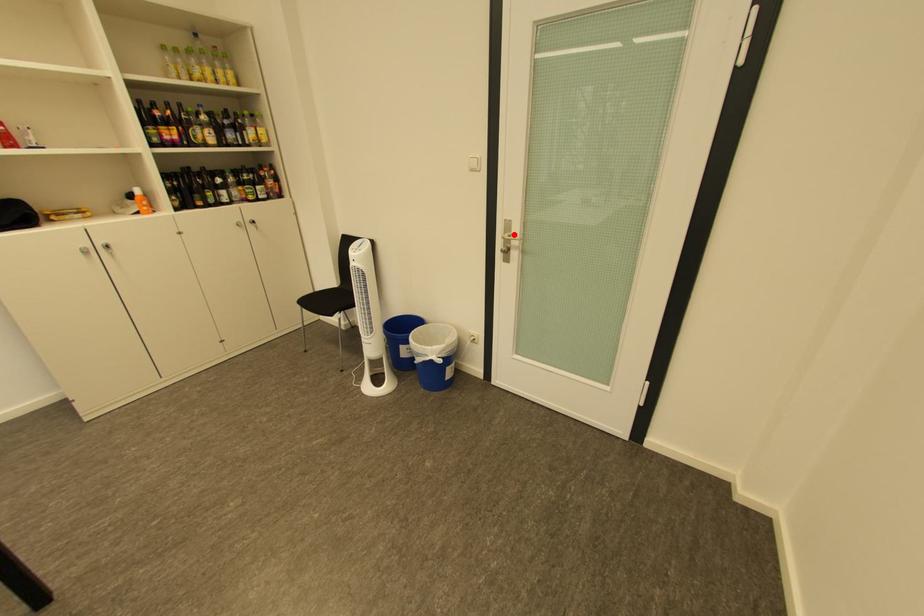
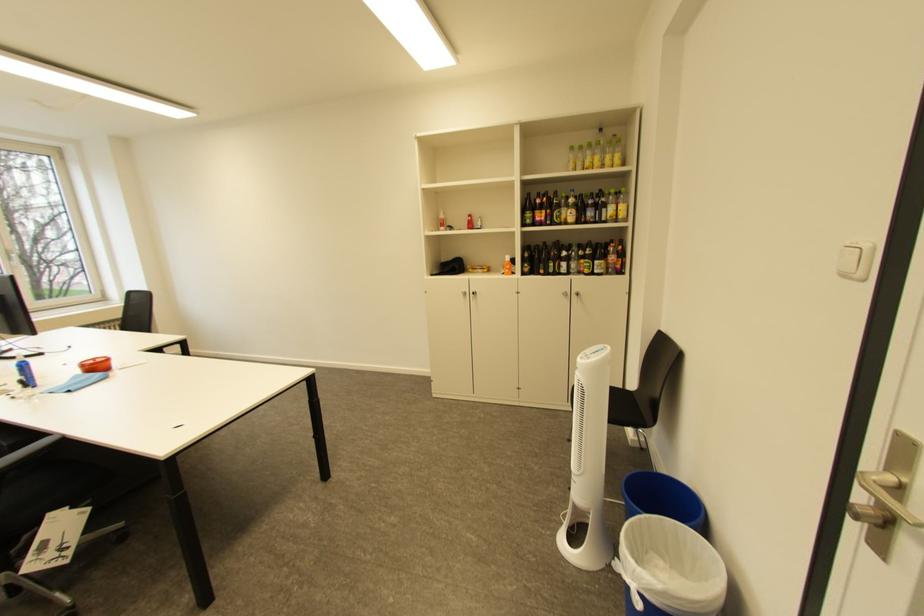
Question: I am providing you with two images of the same scene from different viewpoints. Given a red point in image1, look at the same physical point in image2. Is it:

Choices:
 (A) Closer to the viewpoint
 (B) Farther from the viewpoint

Answer: (B)